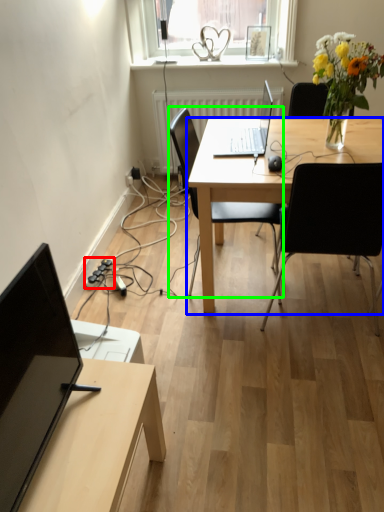
Question: Which is farther away from extension cord (highlighted by a red box)? desk (highlighted by a blue box) or chair (highlighted by a green box)?

Choices:
 (A) desk
 (B) chair

Answer: (A)